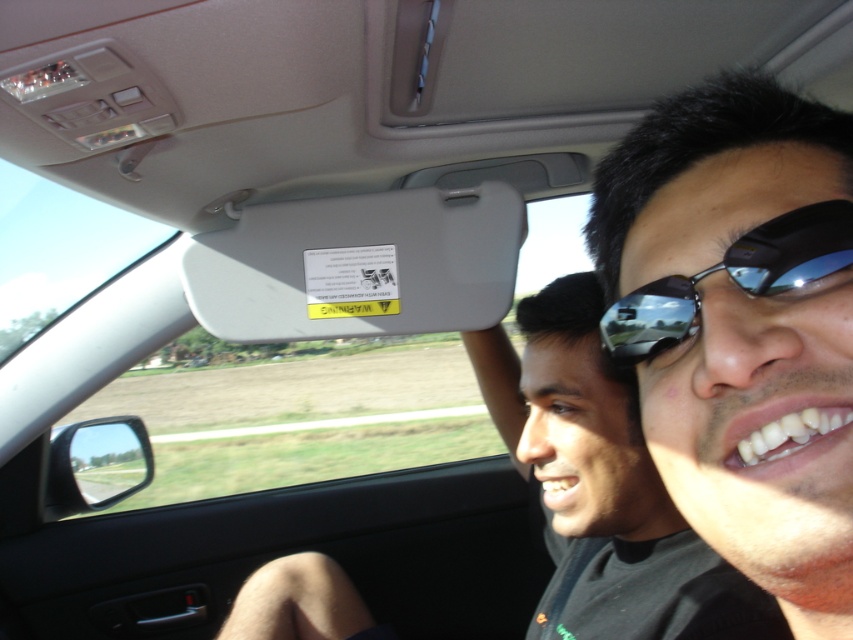
Between matte black sunglasses at upper right and shiny black sunglasses at center, which one appears on the right side from the viewer's perspective?

matte black sunglasses at upper right

Between point (641, 609) and point (801, 250), which one is positioned behind?

Point (641, 609)

I want to click on matte black sunglasses at upper right, so click(x=604, y=483).

Identify the location of matte black sunglasses at upper right. (604, 483).

What do you see at coordinates (743, 326) in the screenshot?
I see `sunglasses at center` at bounding box center [743, 326].

Between point (788, 234) and point (846, 256), which one is positioned in front?

Point (846, 256) is in front.

What are the coordinates of `sunglasses at center` in the screenshot? It's located at (743, 326).

Is sunglasses at center shorter than matte black sunglasses at upper right?

Correct, sunglasses at center is not as tall as matte black sunglasses at upper right.

Can you confirm if sunglasses at center is positioned below matte black sunglasses at upper right?

No.

Find the location of a particular element. The height and width of the screenshot is (640, 853). sunglasses at center is located at coordinates (743, 326).